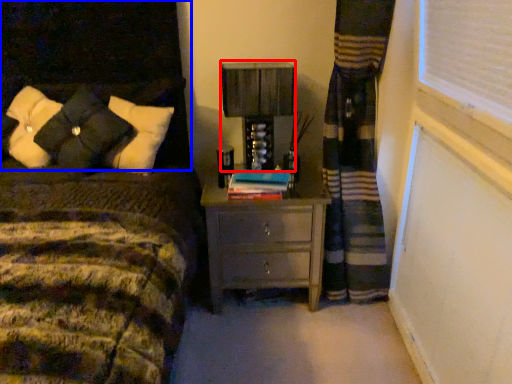
Question: Which object appears closest to the camera in this image, table lamp (highlighted by a red box) or headboard (highlighted by a blue box)?

Choices:
 (A) table lamp
 (B) headboard

Answer: (B)